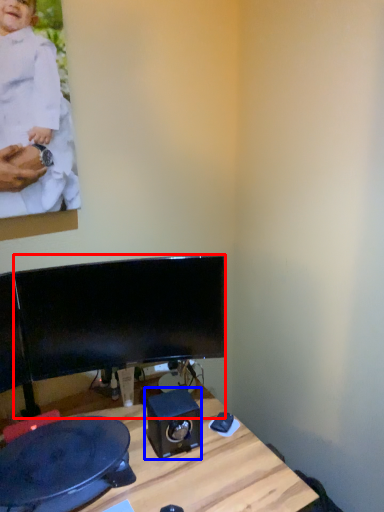
Question: Among these objects, which one is farthest to the camera, computer monitor (highlighted by a red box) or speaker (highlighted by a blue box)?

Choices:
 (A) computer monitor
 (B) speaker

Answer: (B)